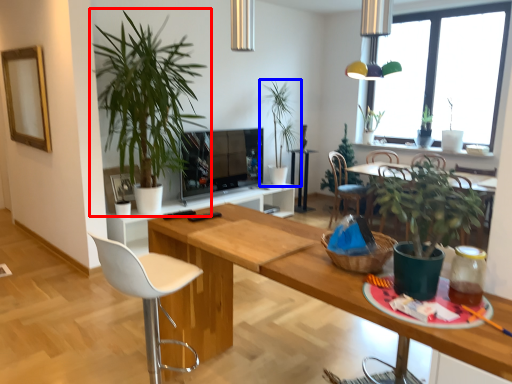
Question: Among these objects, which one is nearest to the camera, houseplant (highlighted by a red box) or houseplant (highlighted by a blue box)?

Choices:
 (A) houseplant
 (B) houseplant

Answer: (A)